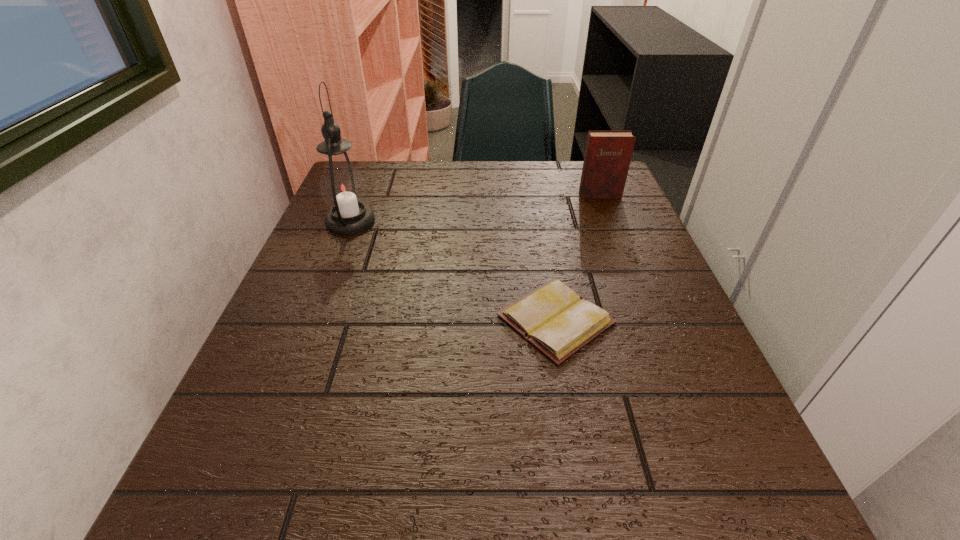
Find the location of a particular element. The height and width of the screenshot is (540, 960). the leftmost object is located at coordinates (342, 186).

You are a GUI agent. You are given a task and a screenshot of the screen. Output one action in this format:
    pyautogui.click(x=<x>, y=<y>)
    Task: Click on the oil lamp
    The height and width of the screenshot is (540, 960).
    Given the screenshot: What is the action you would take?
    pyautogui.click(x=342, y=186)

Where is `the second tallest object`? This screenshot has width=960, height=540. the second tallest object is located at coordinates (607, 158).

This screenshot has height=540, width=960. Identify the location of the right diary. (607, 158).

You are a GUI agent. You are given a task and a screenshot of the screen. Output one action in this format:
    pyautogui.click(x=<x>, y=<y>)
    Task: Click on the shorter diary
    
    Given the screenshot: What is the action you would take?
    pyautogui.click(x=559, y=322)

Locate an element on the screen. This screenshot has width=960, height=540. the nearer diary is located at coordinates (559, 322).

Locate an element on the screen. This screenshot has height=540, width=960. blank area located on the right of the tallest object is located at coordinates (534, 221).

Find the location of a particular element. vacant space situated on the front cover of the rightmost object is located at coordinates (618, 241).

The height and width of the screenshot is (540, 960). Find the location of `free region located 0.120m on the back of the nearest object`. free region located 0.120m on the back of the nearest object is located at coordinates (542, 246).

Where is `object present at the far edge`? The image size is (960, 540). object present at the far edge is located at coordinates (607, 158).